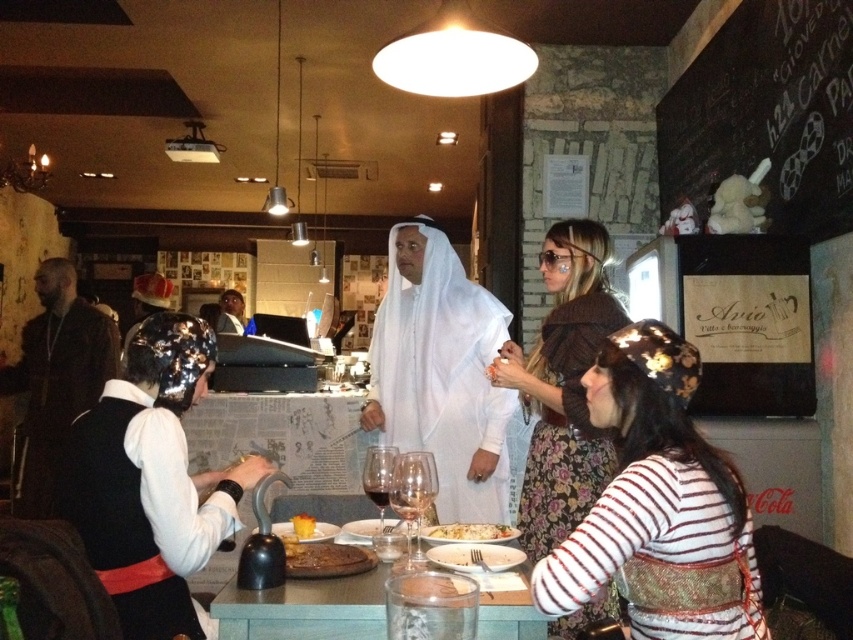
Question: Which object is the closest to the translucent glass wine at center?

Choices:
 (A) white satin robe at lower left
 (B) golden brown steak at center
 (C) chalkboard sign at upper right

Answer: (B)

Question: Which point appears closest to the camera in this image?

Choices:
 (A) (318, 545)
 (B) (845, 45)
 (C) (607, 432)

Answer: (A)

Question: Which of the following is the closest to the observer?

Choices:
 (A) translucent glass wine at center
 (B) translucent glass wine glass at center
 (C) white matte/soft fabric at center

Answer: (A)

Question: Is white matte/soft fabric at center thinner than white satin robe at lower left?

Choices:
 (A) no
 (B) yes

Answer: (A)

Question: Is white matte/soft fabric at center to the right of golden crispy pizza at center from the viewer's perspective?

Choices:
 (A) no
 (B) yes

Answer: (A)

Question: Can you confirm if white matte/soft fabric at center is positioned to the left of translucent glass water at lower center?

Choices:
 (A) yes
 (B) no

Answer: (B)